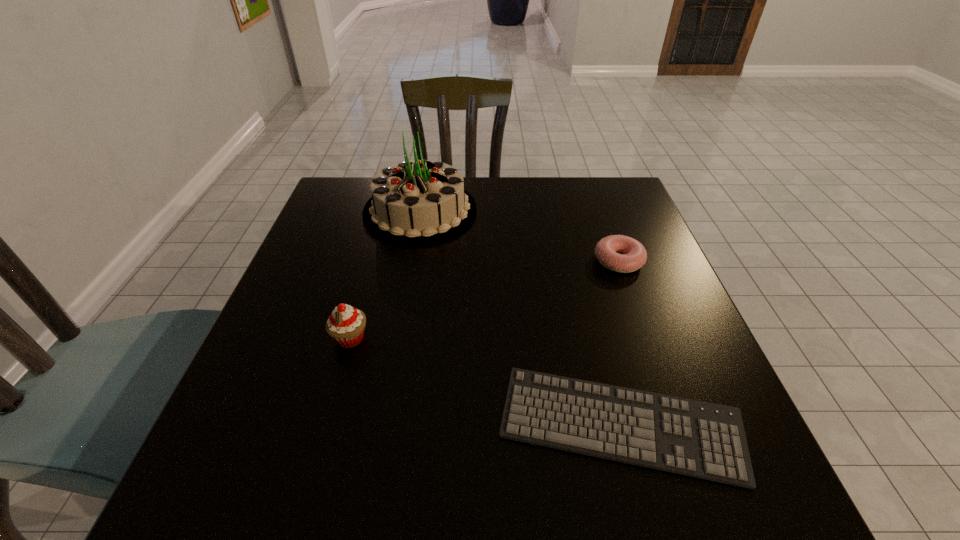
Locate an element on the screen. object positioned at the far edge is located at coordinates (420, 202).

What are the coordinates of `object at the near edge` in the screenshot? It's located at (705, 440).

The image size is (960, 540). I want to click on birthday cake situated at the left edge, so click(x=420, y=202).

You are a GUI agent. You are given a task and a screenshot of the screen. Output one action in this format:
    pyautogui.click(x=<x>, y=<y>)
    Task: Click on the cupcake that is positioned at the left edge
    The height and width of the screenshot is (540, 960).
    Given the screenshot: What is the action you would take?
    click(x=346, y=324)

Find the location of a particular element. The height and width of the screenshot is (540, 960). doughnut that is at the right edge is located at coordinates (634, 255).

Locate an element on the screen. The image size is (960, 540). computer keyboard that is at the right edge is located at coordinates (705, 440).

You are a GUI agent. You are given a task and a screenshot of the screen. Output one action in this format:
    pyautogui.click(x=<x>, y=<y>)
    Task: Click on the object that is positioned at the far left corner
    The width and height of the screenshot is (960, 540).
    Given the screenshot: What is the action you would take?
    pyautogui.click(x=420, y=202)

You are a GUI agent. You are given a task and a screenshot of the screen. Output one action in this format:
    pyautogui.click(x=<x>, y=<y>)
    Task: Click on the object that is at the near right corner
    The height and width of the screenshot is (540, 960).
    Given the screenshot: What is the action you would take?
    pyautogui.click(x=705, y=440)

Identify the location of free space at the far edge. (505, 211).

Locate an element on the screen. This screenshot has width=960, height=540. vacant space at the near edge of the desktop is located at coordinates (388, 484).